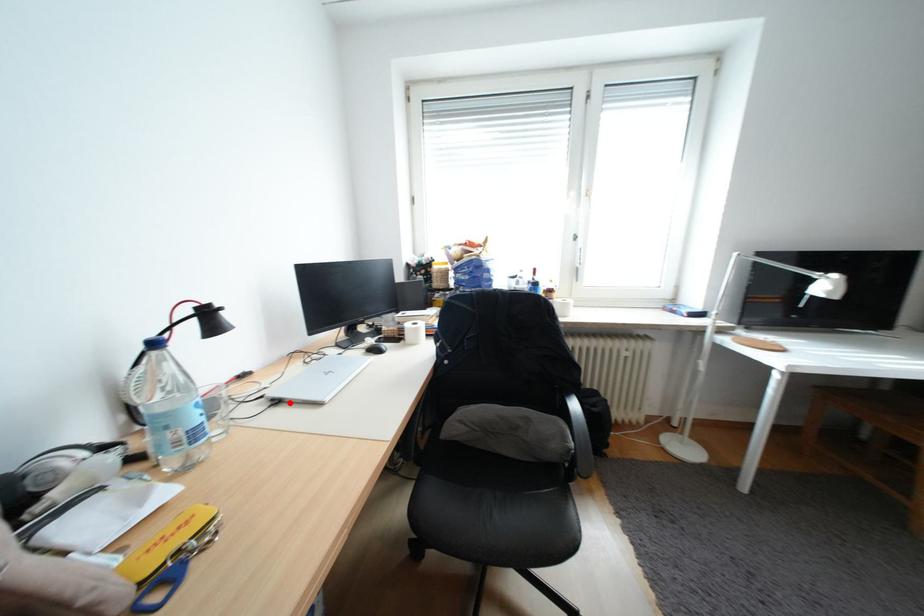
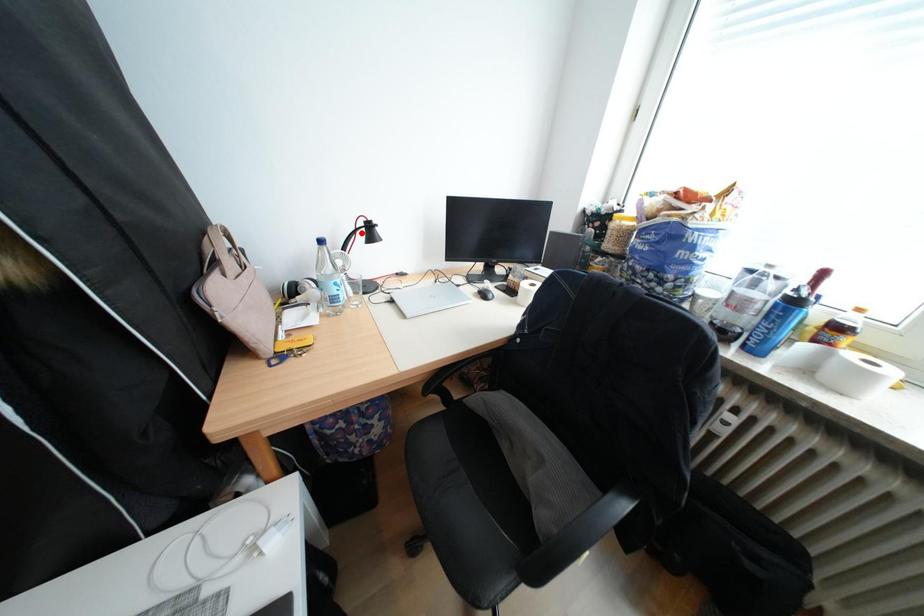
I am providing you with two images of the same scene from different viewpoints. A red point is marked on the first image and another point is marked on the second image. Do the highlighted points in image1 and image2 indicate the same real-world spot?

No